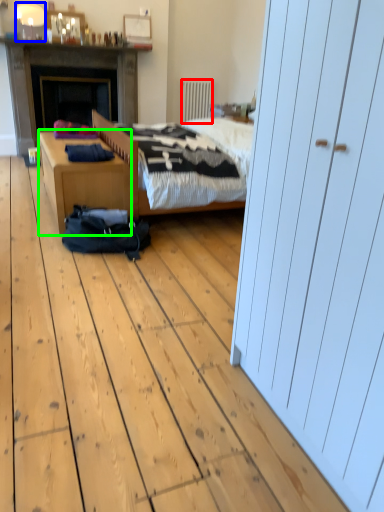
Question: Based on their relative distances, which object is farther from radiator (highlighted by a red box)? Choose from lamp (highlighted by a blue box) and desk (highlighted by a green box).

Choices:
 (A) lamp
 (B) desk

Answer: (B)